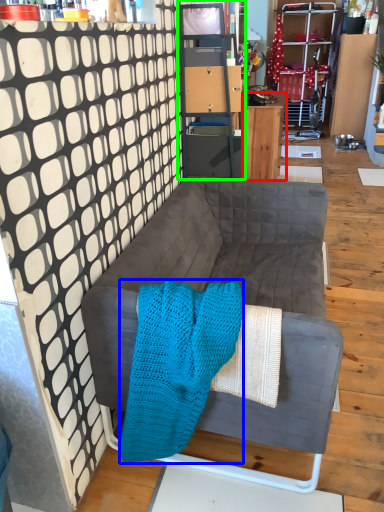
Question: Which is farther away from desk (highlighted by a red box)? blanket (highlighted by a blue box) or cabinetry (highlighted by a green box)?

Choices:
 (A) blanket
 (B) cabinetry

Answer: (A)